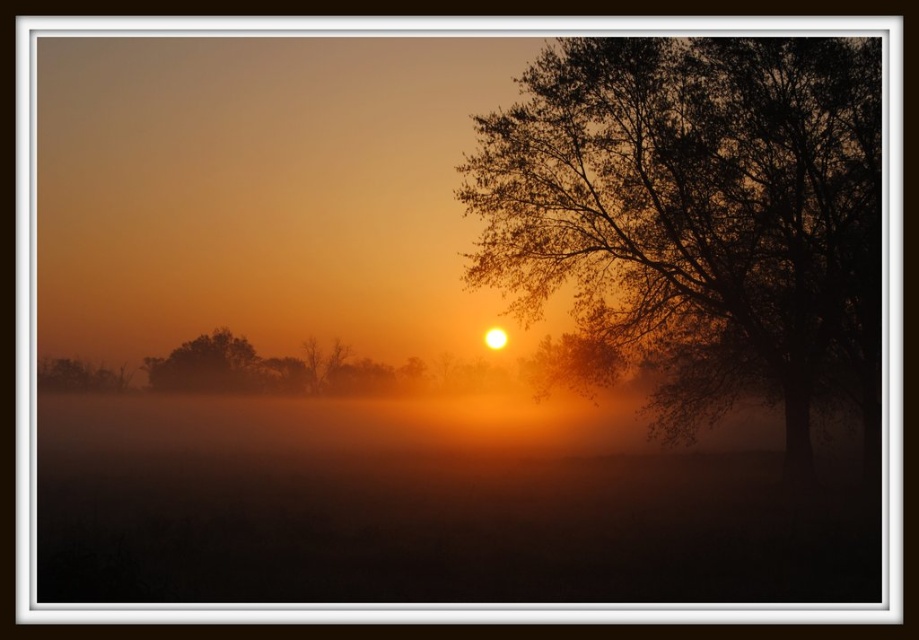
Question: Where is silhouette leafy tree at right located in relation to silhouette tree at left in the image?

Choices:
 (A) right
 (B) left

Answer: (A)

Question: Among these objects, which one is nearest to the camera?

Choices:
 (A) silhouette tree at left
 (B) smooth bark tree at right
 (C) silhouette leafy tree at right

Answer: (C)

Question: Which object appears closest to the camera in this image?

Choices:
 (A) smooth bark tree at right
 (B) silhouette leafy tree at right
 (C) silhouette tree at left

Answer: (B)

Question: Which of the following is the closest to the observer?

Choices:
 (A) (543, 356)
 (B) (853, 72)
 (C) (199, 348)

Answer: (B)

Question: Is silhouette tree at left positioned behind smooth bark tree at right?

Choices:
 (A) no
 (B) yes

Answer: (B)

Question: Can you confirm if silhouette leafy tree at right is positioned to the left of smooth bark tree at right?

Choices:
 (A) yes
 (B) no

Answer: (B)